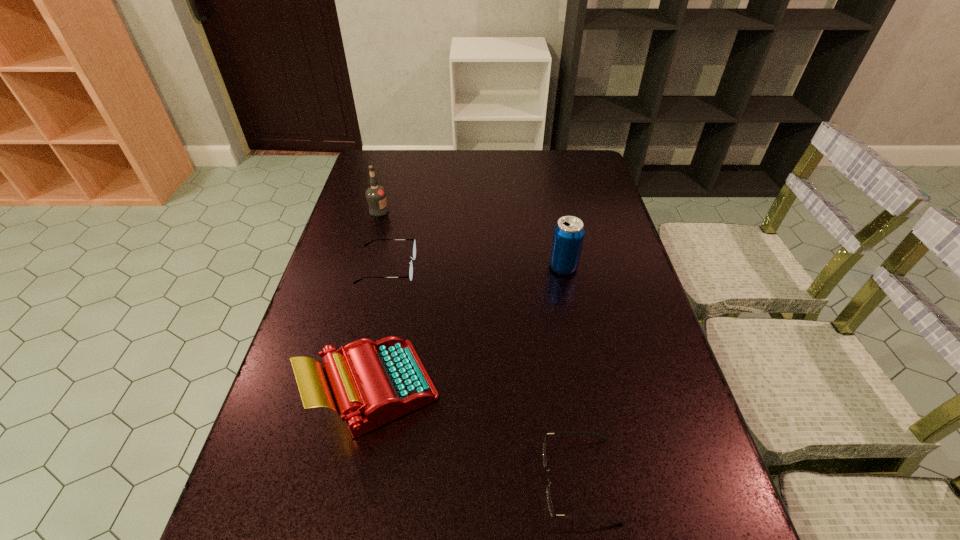
Find the location of a particular element. vacant space at the right edge of the desktop is located at coordinates (695, 495).

Image resolution: width=960 pixels, height=540 pixels. Identify the location of free location at the far left corner of the desktop. (382, 163).

Image resolution: width=960 pixels, height=540 pixels. In order to click on free space at the far right corner in this screenshot , I will do [x=588, y=165].

Find the location of `unoccupied position between the farthest object and the third shortest object`. unoccupied position between the farthest object and the third shortest object is located at coordinates (376, 300).

This screenshot has width=960, height=540. Identify the location of vacant area that lies between the farther spectacles and the third shortest object. (381, 328).

Identify the location of vacant space that is in between the farthest object and the pop soda. pyautogui.click(x=471, y=239).

Where is `free spot between the right spectacles and the third tallest object`? This screenshot has height=540, width=960. free spot between the right spectacles and the third tallest object is located at coordinates (476, 434).

Where is `free spot between the vodka and the shortest object`? This screenshot has width=960, height=540. free spot between the vodka and the shortest object is located at coordinates (479, 345).

The width and height of the screenshot is (960, 540). Find the location of `vacant space that's between the typewriter and the taller spectacles`. vacant space that's between the typewriter and the taller spectacles is located at coordinates (381, 328).

The width and height of the screenshot is (960, 540). Identify the location of free space between the typewriter and the pop soda. (468, 328).